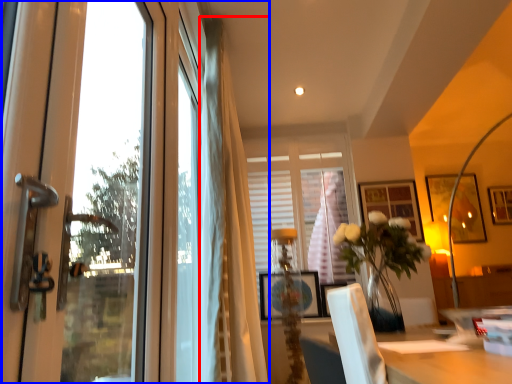
Question: Among these objects, which one is farthest to the camera, curtain (highlighted by a red box) or window (highlighted by a blue box)?

Choices:
 (A) curtain
 (B) window

Answer: (A)